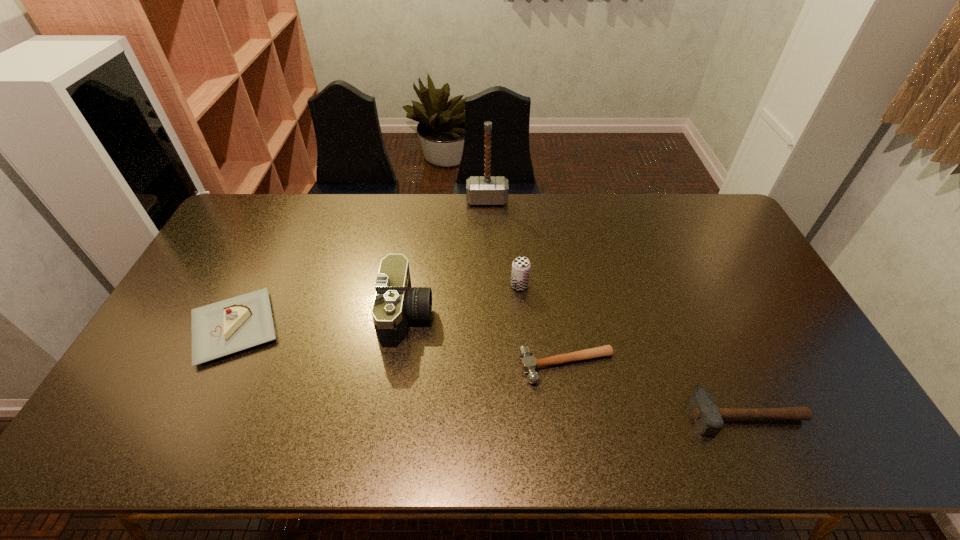
The width and height of the screenshot is (960, 540). I want to click on vacant space that's between the third shortest object and the shortest object, so click(400, 347).

Locate an element on the screen. vacant area between the rightmost object and the leftmost object is located at coordinates (491, 371).

Locate an element on the screen. The width and height of the screenshot is (960, 540). free spot between the cake and the shortest hammer is located at coordinates (400, 347).

Point out which object is positioned as the third nearest to the beer can. Please provide its 2D coordinates. Your answer should be formatted as a tuple, i.e. [(x, y)], where the tuple contains the x and y coordinates of a point satisfying the conditions above.

[(480, 190)]

In order to click on the closest object to the farthest object in this screenshot , I will do `click(521, 265)`.

This screenshot has width=960, height=540. In order to click on hammer that is the third closest to the cake in this screenshot , I will do `click(708, 417)`.

The width and height of the screenshot is (960, 540). Find the location of `hammer that stands as the third closest to the third shortest object`. hammer that stands as the third closest to the third shortest object is located at coordinates (708, 417).

At what (x,y) coordinates should I click in order to perform the action: click on free spot that satisfies the following two spatial constraints: 1. on the front-facing side of the fifth object from right to left; 2. on the back side of the second nearest hammer. Please return your answer as a coordinate pair (x, y). Image resolution: width=960 pixels, height=540 pixels. Looking at the image, I should click on (400, 366).

The height and width of the screenshot is (540, 960). In order to click on free region that satisfies the following two spatial constraints: 1. on the front side of the cake; 2. on the left side of the second nearest hammer in this screenshot , I will do `click(216, 366)`.

You are a GUI agent. You are given a task and a screenshot of the screen. Output one action in this format:
    pyautogui.click(x=<x>, y=<y>)
    Task: Click on the free space in the image that satisfies the following two spatial constraints: 1. on the front side of the shortest hammer; 2. on the left side of the beer can
    This screenshot has height=540, width=960.
    Given the screenshot: What is the action you would take?
    point(526,366)